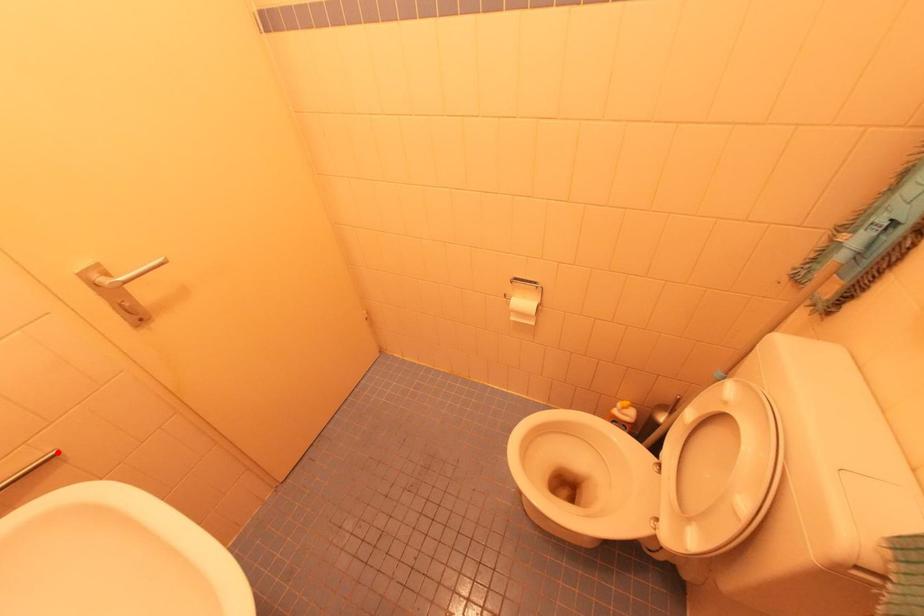
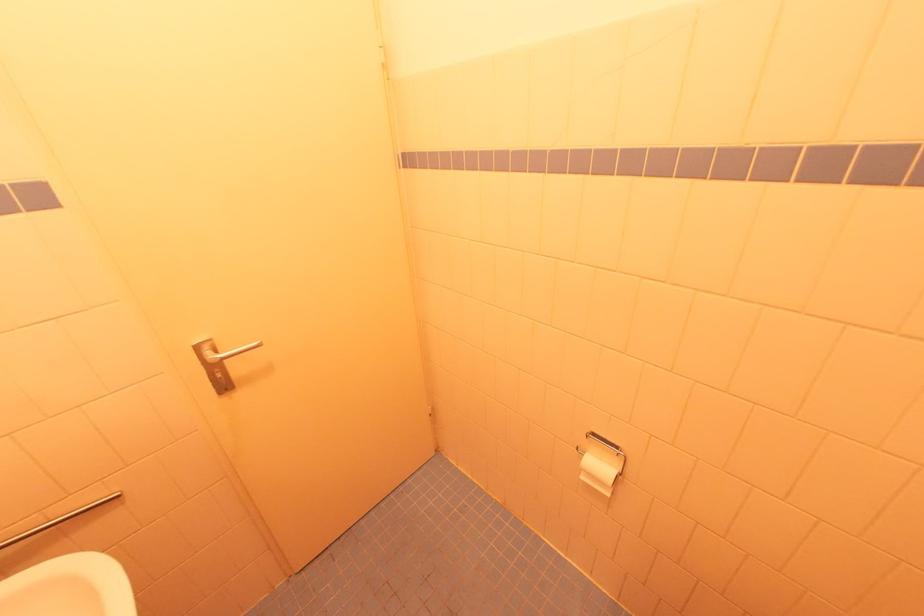
Question: I am providing you with two images of the same scene from different viewpoints. Image1 has a red point marked. In image2, the corresponding 3D location appears at what relative position? Reply with the corresponding letter.

Choices:
 (A) Closer
 (B) Farther

Answer: (A)